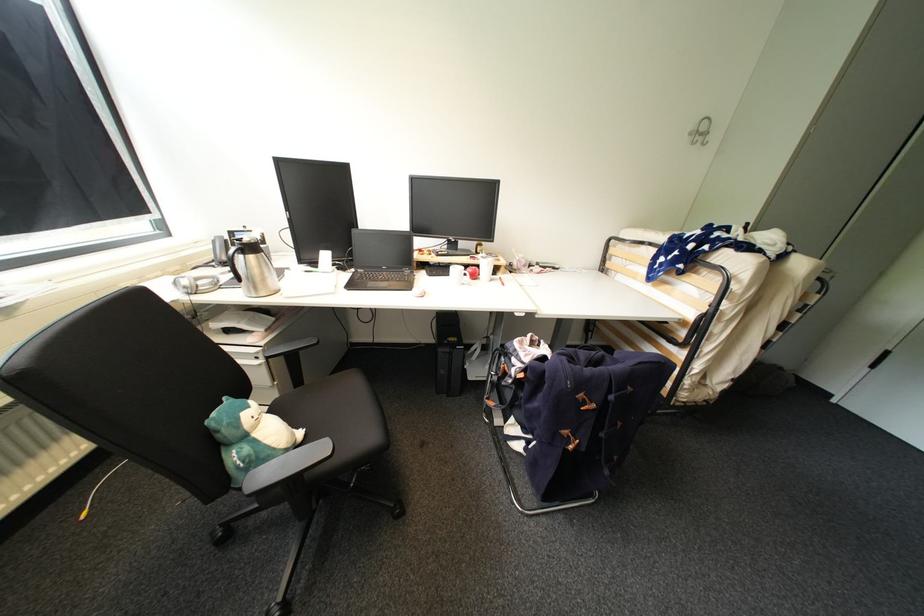
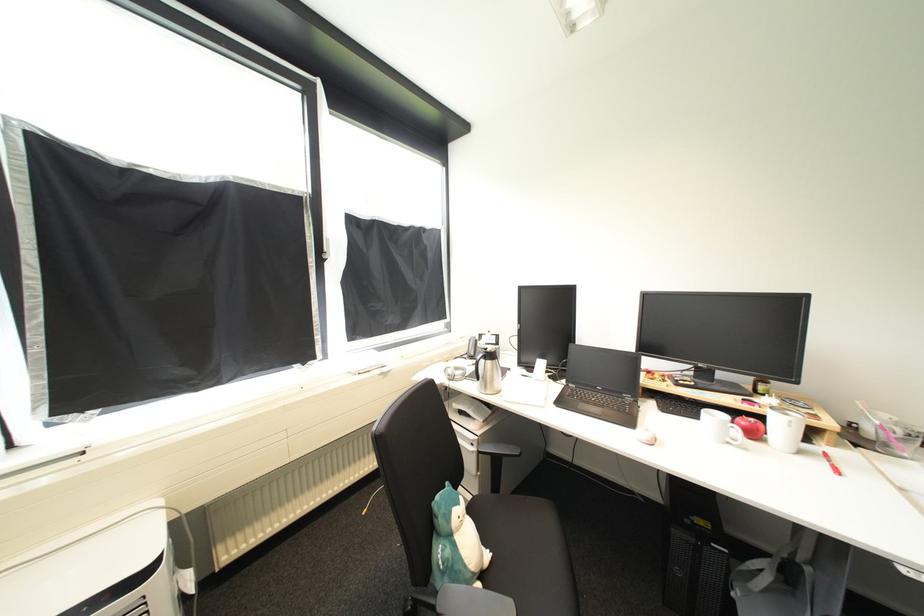
Locate, in the second image, the point that corresponds to [481,277] in the first image.

(761, 436)